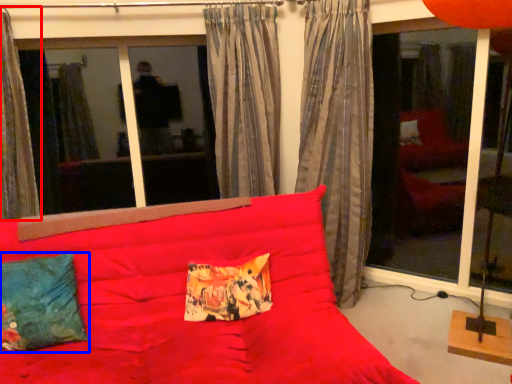
Question: Which object is further to the camera taking this photo, curtain (highlighted by a red box) or pillow (highlighted by a blue box)?

Choices:
 (A) curtain
 (B) pillow

Answer: (A)